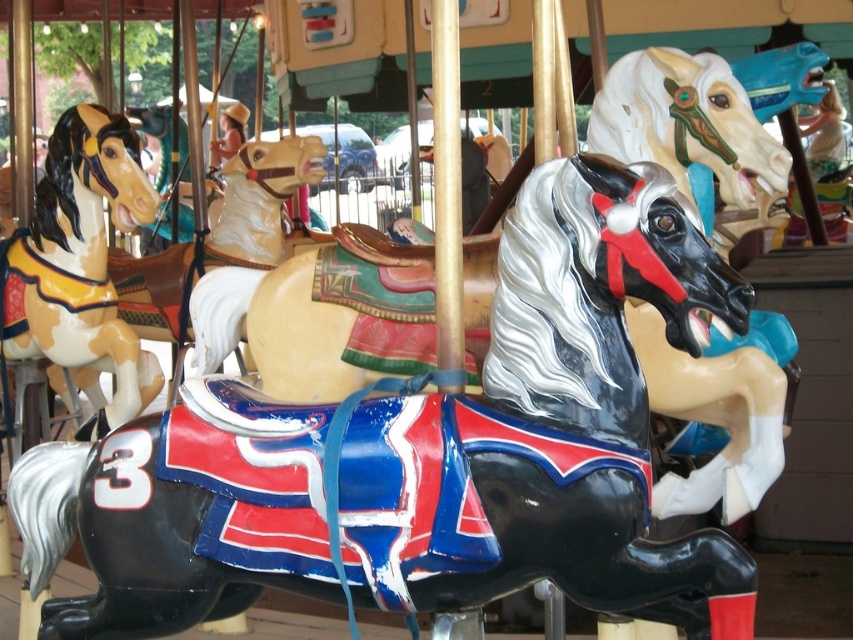
Question: Considering the relative positions of shiny black horse at center and matte brown horse at left in the image provided, where is shiny black horse at center located with respect to matte brown horse at left?

Choices:
 (A) right
 (B) left

Answer: (A)

Question: Among these points, which one is nearest to the camera?

Choices:
 (A) (744, 588)
 (B) (86, 316)

Answer: (A)

Question: Does shiny black horse at center have a smaller size compared to matte brown horse at left?

Choices:
 (A) yes
 (B) no

Answer: (A)

Question: Which is nearer to the matte brown horse at left?

Choices:
 (A) matte brown horse at center
 (B) shiny black horse at center

Answer: (A)

Question: Considering the relative positions of shiny black horse at center and matte brown horse at left in the image provided, where is shiny black horse at center located with respect to matte brown horse at left?

Choices:
 (A) left
 (B) right

Answer: (B)

Question: Estimate the real-world distances between objects in this image. Which object is closer to the matte brown horse at center?

Choices:
 (A) shiny black horse at center
 (B) matte brown horse at left

Answer: (B)